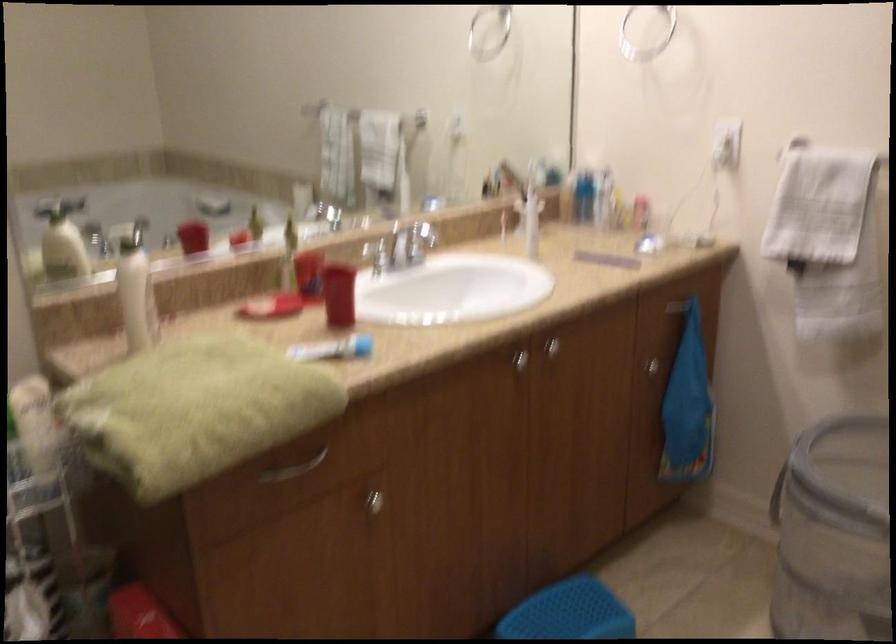
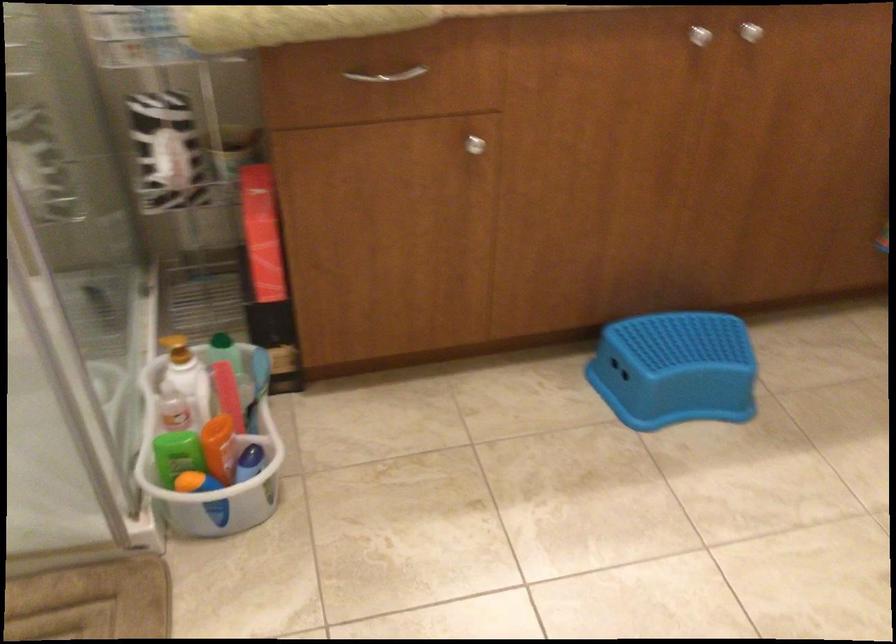
The point at (x=288, y=466) is marked in the first image. Where is the corresponding point in the second image?

(386, 75)